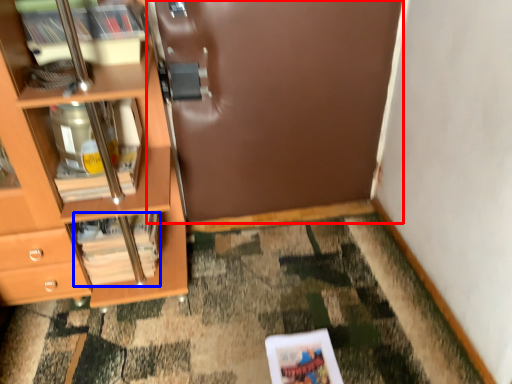
Question: Which of the following is the farthest to the observer, door (highlighted by a red box) or magazine (highlighted by a blue box)?

Choices:
 (A) door
 (B) magazine

Answer: (B)